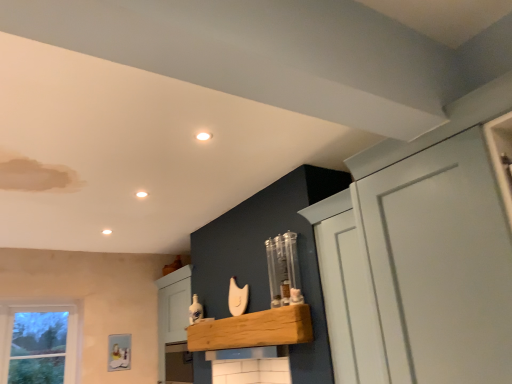
Question: Considering the positions of white matte cupboard at upper right and natural wood shelf at center in the image, is white matte cupboard at upper right wider or thinner than natural wood shelf at center?

Choices:
 (A) wide
 (B) thin

Answer: (A)

Question: Relative to natural wood shelf at center, is white matte cupboard at upper right in front or behind?

Choices:
 (A) front
 (B) behind

Answer: (A)

Question: In terms of height, does white matte cupboard at upper right look taller or shorter compared to natural wood shelf at center?

Choices:
 (A) tall
 (B) short

Answer: (A)

Question: Considering the positions of natural wood shelf at center and white matte cupboard at upper right in the image, is natural wood shelf at center wider or thinner than white matte cupboard at upper right?

Choices:
 (A) thin
 (B) wide

Answer: (A)

Question: Considering their positions, is natural wood shelf at center located in front of or behind white matte cupboard at upper right?

Choices:
 (A) behind
 (B) front

Answer: (A)

Question: From the image's perspective, relative to white matte cupboard at upper right, is natural wood shelf at center above or below?

Choices:
 (A) below
 (B) above

Answer: (A)

Question: From a real-world perspective, is natural wood shelf at center physically located above or below white matte cupboard at upper right?

Choices:
 (A) below
 (B) above

Answer: (A)